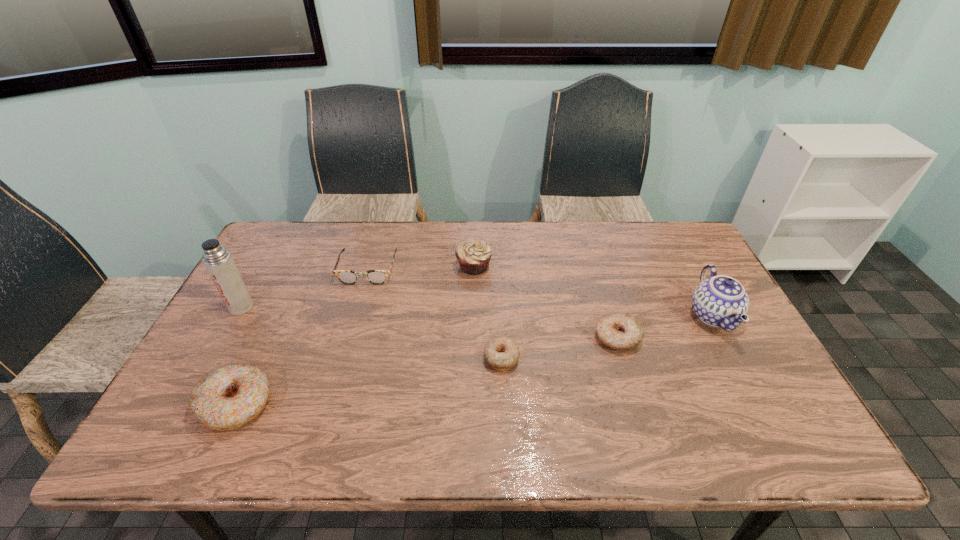
The image size is (960, 540). Find the location of `the nearest doughnut`. the nearest doughnut is located at coordinates (230, 396).

This screenshot has width=960, height=540. I want to click on the leftmost doughnut, so click(x=230, y=396).

The image size is (960, 540). In order to click on the shortest doughnut in this screenshot , I will do coord(502,353).

Where is `the second doughnut from left to right`? The image size is (960, 540). the second doughnut from left to right is located at coordinates (502, 353).

Where is `the rightmost doughnut`? the rightmost doughnut is located at coordinates (620, 331).

This screenshot has width=960, height=540. Identify the location of the second object from right to left. coord(620,331).

Locate an element on the screen. The height and width of the screenshot is (540, 960). thermos bottle is located at coordinates (219, 263).

You are a GUI agent. You are given a task and a screenshot of the screen. Output one action in this format:
    pyautogui.click(x=<x>, y=<y>)
    Task: Click on the spectacles
    The width and height of the screenshot is (960, 540).
    Given the screenshot: What is the action you would take?
    pyautogui.click(x=345, y=276)

You are a GUI agent. You are given a task and a screenshot of the screen. Output one action in this format:
    pyautogui.click(x=<x>, y=<y>)
    Task: Click on the fifth shortest object
    This screenshot has width=960, height=540.
    Given the screenshot: What is the action you would take?
    coord(473,255)

At what (x,y) coordinates should I click in order to perform the action: click on chinaware. Please return your answer as a coordinate pair (x, y). The height and width of the screenshot is (540, 960). Looking at the image, I should click on (720, 301).